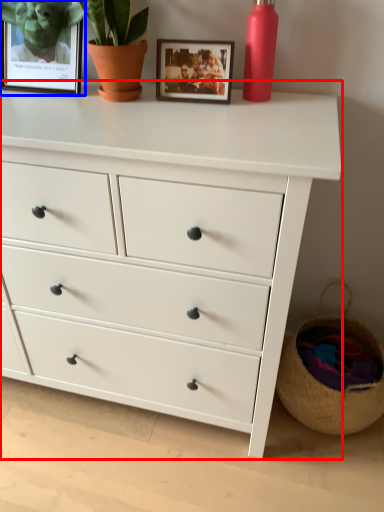
Question: Which of the following is the farthest to the observer, chest of drawers (highlighted by a red box) or picture frame (highlighted by a blue box)?

Choices:
 (A) chest of drawers
 (B) picture frame

Answer: (B)